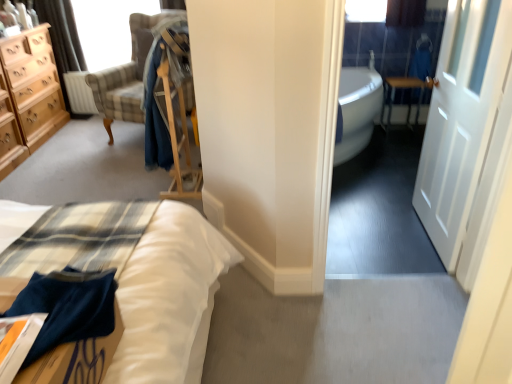
This screenshot has height=384, width=512. Describe the element at coordinates (108, 29) in the screenshot. I see `clear glass window screen at upper left` at that location.

Describe the element at coordinates (154, 98) in the screenshot. I see `blue cotton robe at center` at that location.

What is the approximate height of metallic silver table at right?

It is 19.52 inches.

Measure the distance between point (389, 83) and camera.

Point (389, 83) is 4.35 meters from camera.

Image resolution: width=512 pixels, height=384 pixels. Describe the element at coordinates (174, 282) in the screenshot. I see `white leather bed at lower left` at that location.

Locate an element on the screen. The image size is (512, 384). matte beige curtain at upper left is located at coordinates (62, 38).

Locate an element on the screen. The width and height of the screenshot is (512, 384). window screen above the plaid fabric chair at upper left (from a real-world perspective) is located at coordinates (108, 29).

Based on their sizes in the image, would you say plaid fabric chair at upper left is bigger or smaller than clear glass window screen at upper left?

Considering their sizes, plaid fabric chair at upper left takes up more space than clear glass window screen at upper left.

How far apart are plaid fabric chair at upper left and clear glass window screen at upper left?

A distance of 24.60 inches exists between plaid fabric chair at upper left and clear glass window screen at upper left.

Is point (124, 68) positioned before point (112, 50)?

Yes, it is.

From a real-world perspective, is matte beige curtain at upper left positioned over clear glass window screen at upper left based on gravity?

No, from a real-world perspective, matte beige curtain at upper left is not above clear glass window screen at upper left.

Is matte beige curtain at upper left wider than clear glass window screen at upper left?

Yes.

I want to click on curtain below the clear glass window screen at upper left (from a real-world perspective), so click(x=62, y=38).

Is matte beige curtain at upper left positioned beyond the bounds of clear glass window screen at upper left?

That's correct, matte beige curtain at upper left is outside of clear glass window screen at upper left.

From the image's perspective, is light wood chest of drawers at left located above or below metallic silver table at right?

Clearly, from the image's perspective, light wood chest of drawers at left is above metallic silver table at right.

Considering the relative sizes of light wood chest of drawers at left and metallic silver table at right in the image provided, is light wood chest of drawers at left bigger than metallic silver table at right?

Indeed, light wood chest of drawers at left has a larger size compared to metallic silver table at right.

From a real-world perspective, is light wood chest of drawers at left physically located above or below metallic silver table at right?

light wood chest of drawers at left is above metallic silver table at right.

Does light wood chest of drawers at left come in front of metallic silver table at right?

Yes, light wood chest of drawers at left is in front of metallic silver table at right.

From a real-world perspective, who is located higher, metallic silver table at right or plaid fabric chair at upper left?

plaid fabric chair at upper left, from a real-world perspective.

Which is more to the left, metallic silver table at right or plaid fabric chair at upper left?

plaid fabric chair at upper left is more to the left.

Is metallic silver table at right smaller than plaid fabric chair at upper left?

Correct, metallic silver table at right occupies less space than plaid fabric chair at upper left.

Considering the relative sizes of metallic silver table at right and plaid fabric chair at upper left in the image provided, is metallic silver table at right thinner than plaid fabric chair at upper left?

Indeed, metallic silver table at right has a lesser width compared to plaid fabric chair at upper left.

From a real-world perspective, which is physically below, clear glass window screen at upper left or plaid fabric chair at upper left?

plaid fabric chair at upper left, from a real-world perspective.

This screenshot has height=384, width=512. I want to click on chair located on the right of clear glass window screen at upper left, so click(x=127, y=75).

Is clear glass window screen at upper left looking in the opposite direction of plaid fabric chair at upper left?

No.

Which object is closer to the camera, clear glass window screen at upper left or plaid fabric chair at upper left?

plaid fabric chair at upper left is in front.

How much distance is there between white glossy bathtub at right and plaid fabric chair at upper left?

The distance of white glossy bathtub at right from plaid fabric chair at upper left is 1.76 meters.

Looking at this image, considering the relative sizes of white glossy bathtub at right and plaid fabric chair at upper left in the image provided, is white glossy bathtub at right bigger than plaid fabric chair at upper left?

No, white glossy bathtub at right is not bigger than plaid fabric chair at upper left.

From the picture: From a real-world perspective, which is physically below, white glossy bathtub at right or plaid fabric chair at upper left?

From a 3D spatial view, white glossy bathtub at right is below.

Where is `chair that appears above the white glossy bathtub at right (from a real-world perspective)`? chair that appears above the white glossy bathtub at right (from a real-world perspective) is located at coordinates (127, 75).

Considering the relative sizes of white leather bed at lower left and white matte door at right in the image provided, is white leather bed at lower left shorter than white matte door at right?

Yes, white leather bed at lower left is shorter than white matte door at right.

Which is closer, (162,225) or (444,149)?

Point (162,225) is positioned closer to the camera compared to point (444,149).

Can you confirm if white leather bed at lower left is thinner than white matte door at right?

No.

Are white leather bed at lower left and white matte door at right far apart?

Indeed, white leather bed at lower left is not near white matte door at right.

Image resolution: width=512 pixels, height=384 pixels. Find the location of `window screen above the plaid fabric chair at upper left (from the image's perspective)`. window screen above the plaid fabric chair at upper left (from the image's perspective) is located at coordinates (108, 29).

This screenshot has width=512, height=384. I want to click on window screen above the matte beige curtain at upper left (from a real-world perspective), so click(108, 29).

Which object lies further to the anchor point matte beige curtain at upper left, light wood chest of drawers at left or blue cotton robe at center?

blue cotton robe at center lies further to matte beige curtain at upper left than the other object.

Estimate the real-world distances between objects in this image. Which object is closer to metallic silver table at right, blue cotton robe at center or white glossy bathtub at right?

white glossy bathtub at right lies closer to metallic silver table at right than the other object.

When comparing their distances from plaid fabric chair at upper left, does matte beige curtain at upper left or white leather bed at lower left seem closer?

matte beige curtain at upper left lies closer to plaid fabric chair at upper left than the other object.

From the image, which object appears to be farther from clear glass window screen at upper left, metallic silver table at right or plaid fabric chair at upper left?

Among the two, metallic silver table at right is located further to clear glass window screen at upper left.

Considering their positions, is metallic silver table at right positioned further to white glossy bathtub at right than white leather bed at lower left?

white leather bed at lower left is positioned further to the anchor white glossy bathtub at right.

Considering their positions, is metallic silver table at right positioned further to white leather bed at lower left than white matte door at right?

The object further to white leather bed at lower left is metallic silver table at right.

Considering their positions, is matte beige curtain at upper left positioned further to blue cotton robe at center than light wood chest of drawers at left?

The object further to blue cotton robe at center is matte beige curtain at upper left.

Based on their spatial positions, is blue cotton robe at center or clear glass window screen at upper left further from white leather bed at lower left?

clear glass window screen at upper left lies further to white leather bed at lower left than the other object.

What are the coordinates of `window screen between light wood chest of drawers at left and white glossy bathtub at right` in the screenshot? It's located at (108, 29).

The height and width of the screenshot is (384, 512). I want to click on chest of drawers between blue cotton robe at center and clear glass window screen at upper left from front to back, so click(28, 96).

Locate an element on the screen. robe located between plaid fabric chair at upper left and white glossy bathtub at right in the left-right direction is located at coordinates tap(154, 98).

The height and width of the screenshot is (384, 512). In order to click on robe between white leather bed at lower left and plaid fabric chair at upper left from front to back in this screenshot , I will do `click(154, 98)`.